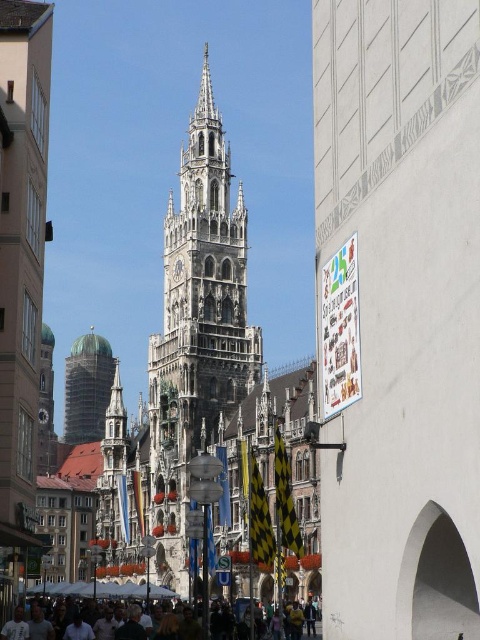
Is point (212, 280) closer to viewer compared to point (40, 620)?

No, it is behind (40, 620).

The height and width of the screenshot is (640, 480). What do you see at coordinates (202, 296) in the screenshot?
I see `stone gothic tower at center` at bounding box center [202, 296].

Where is `stone gothic tower at center`? This screenshot has width=480, height=640. stone gothic tower at center is located at coordinates (202, 296).

Can you confirm if dark gray concrete crowd at lower center is taller than green copper dome at center?

No, dark gray concrete crowd at lower center is not taller than green copper dome at center.

Who is shorter, dark gray concrete crowd at lower center or green copper dome at center?

Standing shorter between the two is dark gray concrete crowd at lower center.

Who is more forward, (134, 616) or (108, 394)?

Positioned in front is point (134, 616).

You are a GUI agent. You are given a task and a screenshot of the screen. Output one action in this format:
    pyautogui.click(x=<x>, y=<y>)
    Task: Click on the dark gray concrete crowd at lower center
    Image resolution: width=480 pixels, height=640 pixels.
    Given the screenshot: What is the action you would take?
    pyautogui.click(x=106, y=627)

Is stone gothic tower at center above green copper dome at center?

Indeed, stone gothic tower at center is positioned over green copper dome at center.

Is stone gothic tower at center smaller than green copper dome at center?

Actually, stone gothic tower at center might be larger than green copper dome at center.

Is point (156, 456) farther from viewer compared to point (82, 410)?

That is False.

Locate an element on the screen. The height and width of the screenshot is (640, 480). stone gothic tower at center is located at coordinates (202, 296).